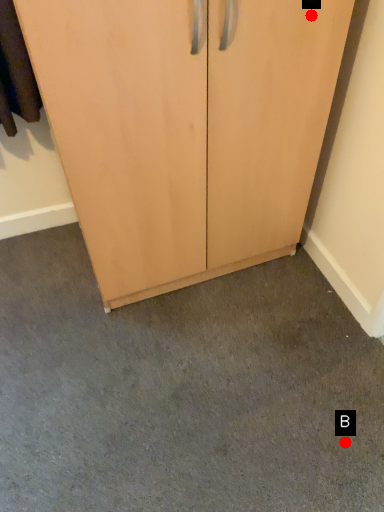
Question: Two points are circled on the image, labeled by A and B beside each circle. Which point is closer to the camera?

Choices:
 (A) A is closer
 (B) B is closer

Answer: (A)